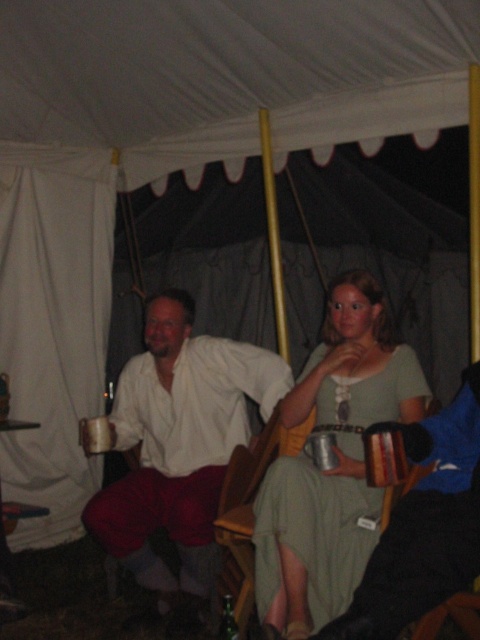
Question: Does matte green dress at center appear on the left side of matte white shirt at center?

Choices:
 (A) yes
 (B) no

Answer: (B)

Question: Which object is closer to the camera taking this photo?

Choices:
 (A) matte green dress at center
 (B) matte white shirt at center

Answer: (A)

Question: Is matte green dress at center positioned in front of matte white shirt at center?

Choices:
 (A) no
 (B) yes

Answer: (B)

Question: Which point is farther from the camera taking this photo?

Choices:
 (A) (119, 544)
 (B) (338, 339)

Answer: (A)

Question: Where is matte green dress at center located in relation to matte white shirt at center in the image?

Choices:
 (A) above
 (B) below

Answer: (A)